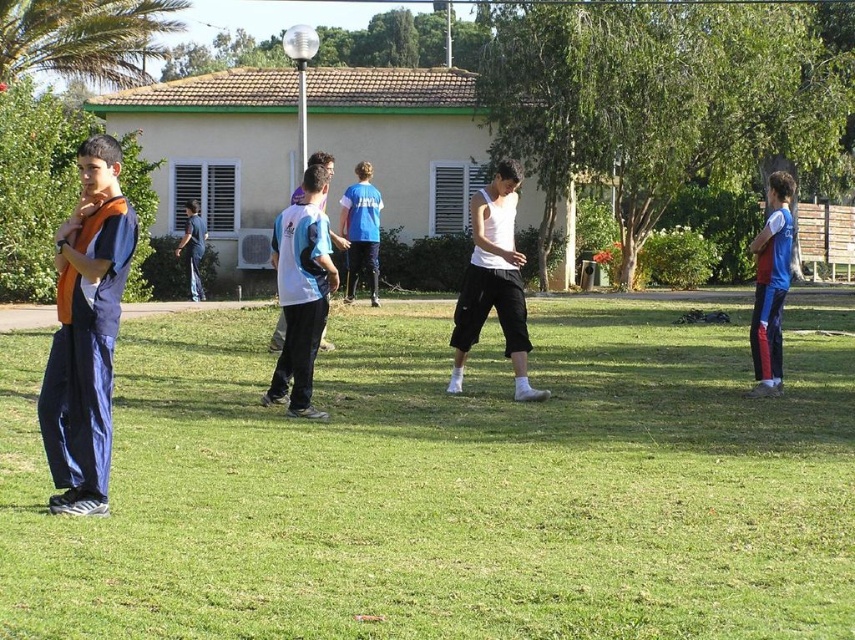
Question: Which of the following is the farthest from the observer?

Choices:
 (A) (753, 323)
 (B) (458, 401)

Answer: (A)

Question: Can you confirm if white jersey at center is positioned to the left of dark blue jeans at center?

Choices:
 (A) yes
 (B) no

Answer: (B)

Question: Does matte blue tracksuit at left appear over dark blue jeans at center?

Choices:
 (A) yes
 (B) no

Answer: (B)

Question: Among these points, which one is farthest from the camera?

Choices:
 (A) (491, 593)
 (B) (770, 273)
 (C) (105, 484)

Answer: (B)

Question: Among these points, which one is nearest to the camera?

Choices:
 (A) (828, 387)
 (B) (479, 257)

Answer: (B)

Question: Does matte blue tracksuit at left appear over dark blue jeans at center?

Choices:
 (A) no
 (B) yes

Answer: (A)